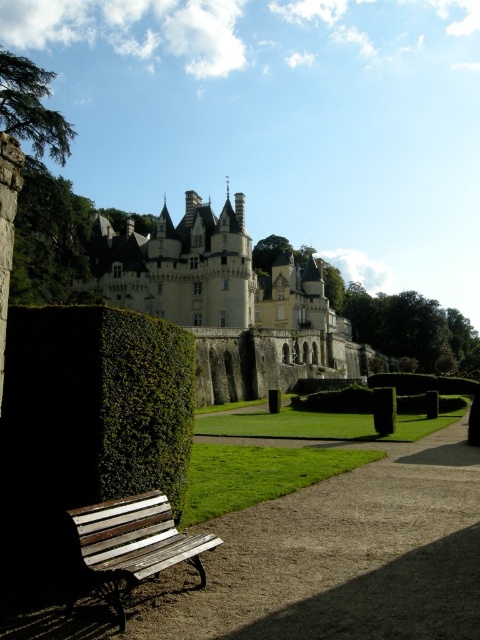
Question: Can you confirm if dark green hedge at lower left is thinner than wooden bench at lower left?

Choices:
 (A) yes
 (B) no

Answer: (B)

Question: Considering the real-world distances, which object is farthest from the wooden bench at lower left?

Choices:
 (A) brown gravel path at lower center
 (B) stone castle at center
 (C) dark green hedge at lower left

Answer: (B)

Question: Can you confirm if brown gravel path at lower center is positioned to the left of green leafy hedge at lower center?

Choices:
 (A) yes
 (B) no

Answer: (A)

Question: Which point is closer to the camera taking this photo?

Choices:
 (A) click(x=277, y=262)
 (B) click(x=180, y=547)
 (C) click(x=424, y=624)

Answer: (C)

Question: Is brown gravel path at lower center smaller than wooden bench at lower left?

Choices:
 (A) yes
 (B) no

Answer: (B)

Question: Which of the following is the farthest from the observer?

Choices:
 (A) stone castle at center
 (B) brown gravel path at lower center
 (C) wooden bench at lower left

Answer: (A)